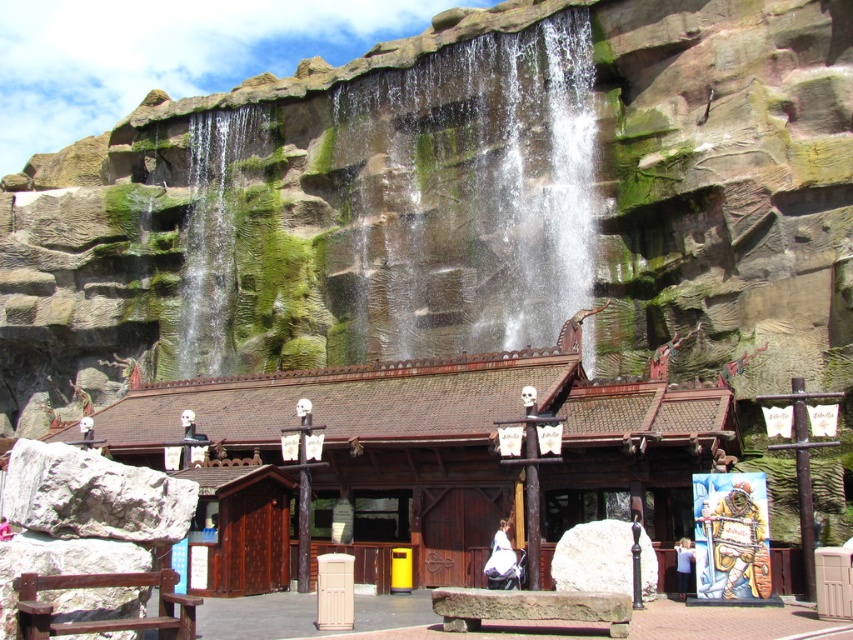
Question: Which object is farther from the camera taking this photo?

Choices:
 (A) green mossy rock at upper left
 (B) green mossy rock at center

Answer: (A)

Question: Which of the following is the farthest from the observer?

Choices:
 (A) wooden pirate figure at center
 (B) white cotton dress at center
 (C) green mossy rock at center

Answer: (C)

Question: Can you confirm if wooden pirate figure at center is bigger than white marble stone at center?

Choices:
 (A) no
 (B) yes

Answer: (B)

Question: Among these points, which one is farthest from the camera?

Choices:
 (A) (732, 582)
 (B) (579, 109)
 (C) (508, 576)

Answer: (B)

Question: Observing the image, what is the correct spatial positioning of green mossy rock at center in reference to white marble stone at center?

Choices:
 (A) right
 (B) left

Answer: (B)

Question: From the image, what is the correct spatial relationship of green mossy rock at center in relation to wooden pirate figure at center?

Choices:
 (A) below
 (B) above

Answer: (B)